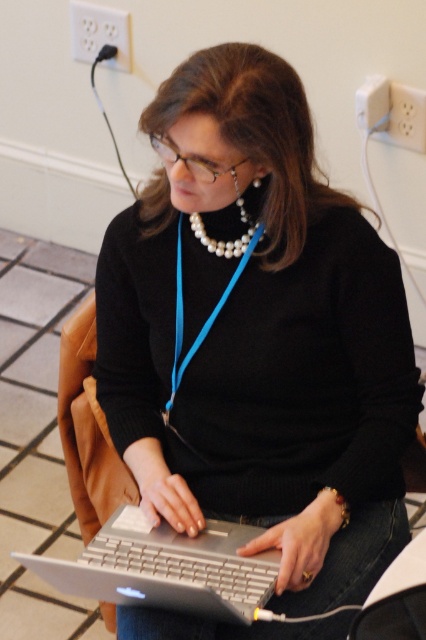
Does blue fabric lanyard at center have a lesser width compared to pearl necklace at center?

In fact, blue fabric lanyard at center might be wider than pearl necklace at center.

Is the position of blue fabric lanyard at center less distant than that of pearl necklace at center?

That is False.

At what (x,y) coordinates should I click in order to perform the action: click on blue fabric lanyard at center. Please return your answer as a coordinate pair (x, y). This screenshot has width=426, height=640. Looking at the image, I should click on (209, 316).

Does silver metallic laptop at center have a larger size compared to blue fabric lanyard at center?

Yes.

Who is positioned more to the left, silver metallic laptop at center or blue fabric lanyard at center?

silver metallic laptop at center

Measure the distance between silver metallic laptop at center and camera.

silver metallic laptop at center is 1.25 meters away from camera.

Locate an element on the screen. This screenshot has width=426, height=640. silver metallic laptop at center is located at coordinates (166, 568).

Between silver metallic laptop at center and pearl necklace at center, which one appears on the right side from the viewer's perspective?

pearl necklace at center

Does point (57, 564) come farther from viewer compared to point (247, 221)?

No, (57, 564) is in front of (247, 221).

Does point (91, 568) come farther from viewer compared to point (239, 205)?

That is False.

Where is `silver metallic laptop at center`? The image size is (426, 640). silver metallic laptop at center is located at coordinates (166, 568).